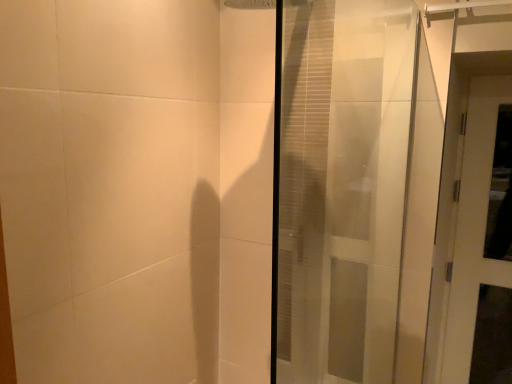
Question: Is white glossy door at right, the 2th door in the left-to-right sequence, oriented away from transparent glass door at center, positioned as the 1th door in left-to-right order?

Choices:
 (A) no
 (B) yes

Answer: (A)

Question: From a real-world perspective, is white glossy door at right, the 2th door in the left-to-right sequence, over transparent glass door at center, positioned as the 1th door in left-to-right order?

Choices:
 (A) no
 (B) yes

Answer: (A)

Question: Is white glossy door at right, which appears as the second door when viewed from the front, closer to the viewer compared to transparent glass door at center, the second door when ordered from back to front?

Choices:
 (A) no
 (B) yes

Answer: (A)

Question: From a real-world perspective, is white glossy door at right, which appears as the second door when viewed from the front, physically below transparent glass door at center, positioned as the 1th door in left-to-right order?

Choices:
 (A) yes
 (B) no

Answer: (A)

Question: Could you tell me if white glossy door at right, which appears as the second door when viewed from the front, is turned towards transparent glass door at center, the second door when ordered from back to front?

Choices:
 (A) yes
 (B) no

Answer: (B)

Question: Are white glossy door at right, which appears as the second door when viewed from the front, and transparent glass door at center, the first door positioned from the front, beside each other?

Choices:
 (A) no
 (B) yes

Answer: (A)

Question: Is transparent glass door at center, the second door in the right-to-left sequence, to the left of white glossy door at right, the 1th door in the back-to-front sequence, from the viewer's perspective?

Choices:
 (A) no
 (B) yes

Answer: (B)

Question: Is transparent glass door at center, the second door in the right-to-left sequence, wider than white glossy door at right, the 2th door in the left-to-right sequence?

Choices:
 (A) yes
 (B) no

Answer: (A)

Question: Would you say transparent glass door at center, the second door when ordered from back to front, is outside white glossy door at right, which appears as the second door when viewed from the front?

Choices:
 (A) yes
 (B) no

Answer: (A)

Question: Is transparent glass door at center, positioned as the 1th door in left-to-right order, far from white glossy door at right, the 1th door in the back-to-front sequence?

Choices:
 (A) yes
 (B) no

Answer: (B)

Question: Is the position of transparent glass door at center, the second door when ordered from back to front, more distant than that of white glossy door at right, the 2th door in the left-to-right sequence?

Choices:
 (A) no
 (B) yes

Answer: (A)

Question: From the image's perspective, is transparent glass door at center, positioned as the 1th door in left-to-right order, below white glossy door at right, which ranks as the first door in right-to-left order?

Choices:
 (A) no
 (B) yes

Answer: (A)

Question: Is point (463, 312) positioned closer to the camera than point (381, 77)?

Choices:
 (A) farther
 (B) closer

Answer: (A)